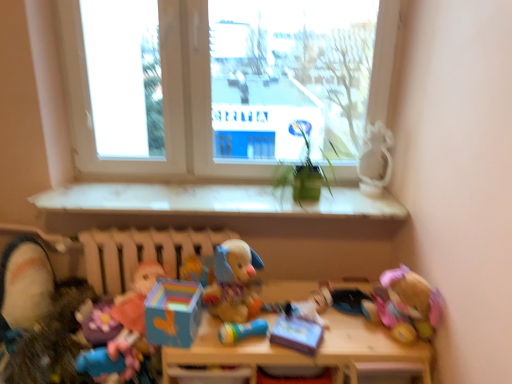
In order to click on free area in between fluffy pink teddy bear at right, which is counted as the 2th toy, starting from the right, and matte cardboard box at center, which ranks as the 3th toy in right-to-left order in this screenshot , I will do `click(352, 335)`.